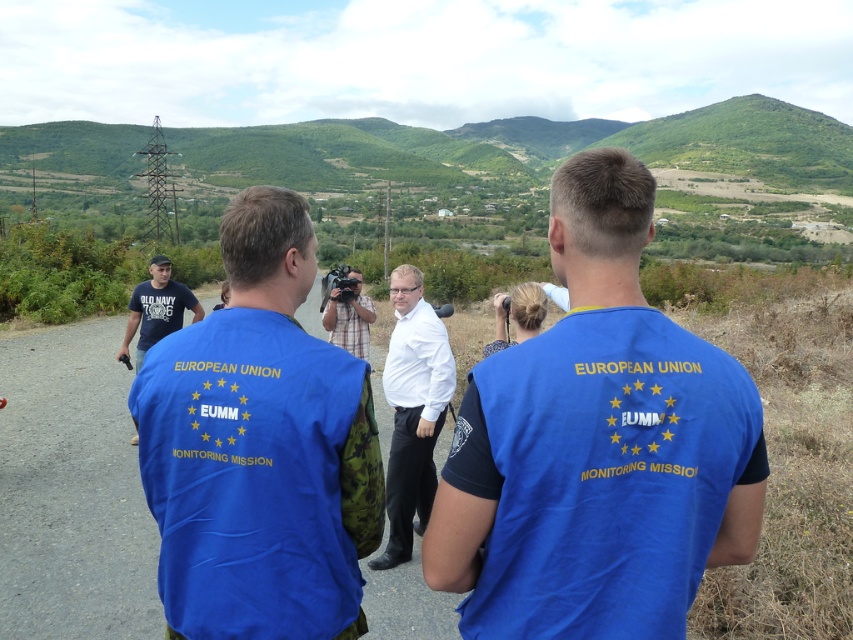
Question: Can you confirm if dark blue t-shirt at left is positioned to the left of plaid shirt at center?

Choices:
 (A) no
 (B) yes

Answer: (B)

Question: Which point is farther from the camera taking this photo?

Choices:
 (A) (409, 365)
 (B) (132, 324)

Answer: (B)

Question: Which of these objects is positioned farthest from the white shirt at center?

Choices:
 (A) dark blue t-shirt at left
 (B) plaid shirt at center
 (C) white matte shirt at center

Answer: (A)

Question: Which of the following is the farthest from the observer?

Choices:
 (A) (402, 314)
 (B) (154, 328)
 (C) (187, 522)
 (D) (363, 301)

Answer: (D)

Question: Does blue fabric shirt at center appear under white matte shirt at center?

Choices:
 (A) yes
 (B) no

Answer: (B)

Question: Is white matte shirt at center in front of plaid shirt at center?

Choices:
 (A) no
 (B) yes

Answer: (B)